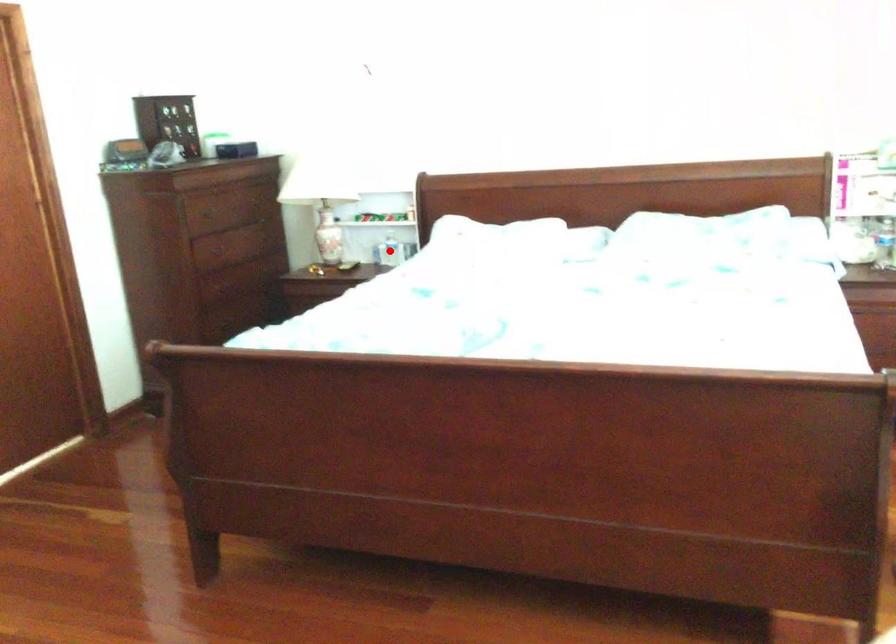
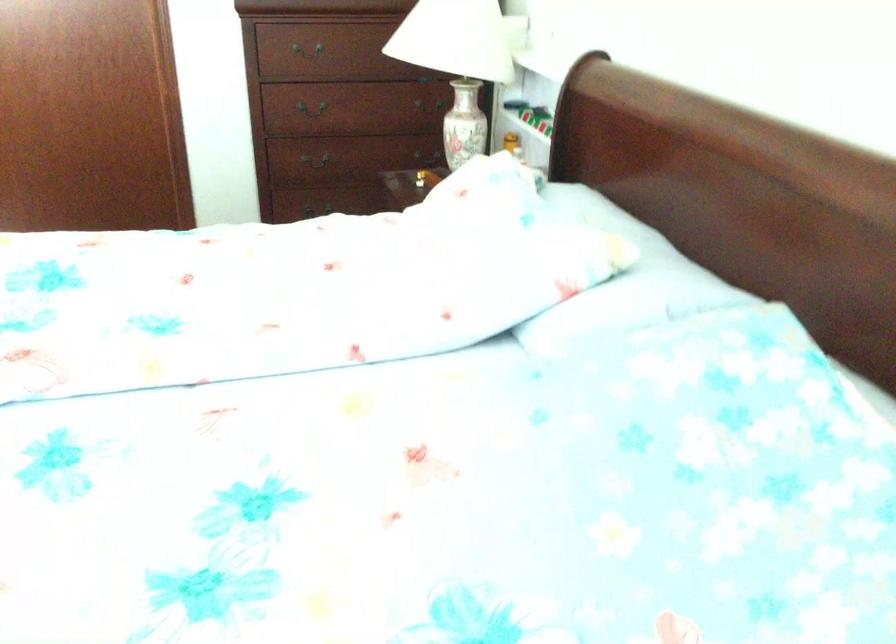
Question: I am providing you with two images of the same scene from different viewpoints. A red point is marked on the first image. At the location where the point appears in image 1, is it still visible in image 2?

Choices:
 (A) Yes
 (B) No

Answer: (B)